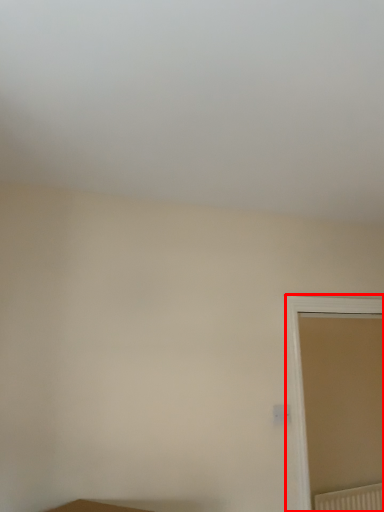
Question: Considering the relative positions of window (annotated by the red box) and radiator in the image provided, where is window (annotated by the red box) located with respect to the staircase?

Choices:
 (A) right
 (B) left

Answer: (B)